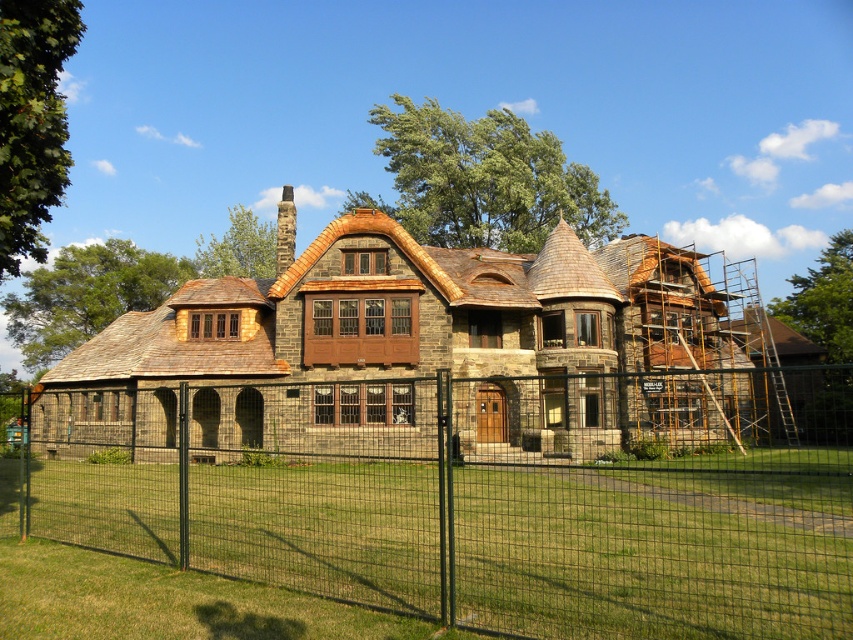
Question: Which point is closer to the camera?

Choices:
 (A) stone house at center
 (B) green wire mesh fence at center

Answer: (B)

Question: Does green wire mesh fence at center have a lesser width compared to stone house at center?

Choices:
 (A) no
 (B) yes

Answer: (A)

Question: Is green wire mesh fence at center further to the viewer compared to stone house at center?

Choices:
 (A) yes
 (B) no

Answer: (B)

Question: From the image, what is the correct spatial relationship of green wire mesh fence at center in relation to stone house at center?

Choices:
 (A) below
 (B) above

Answer: (A)